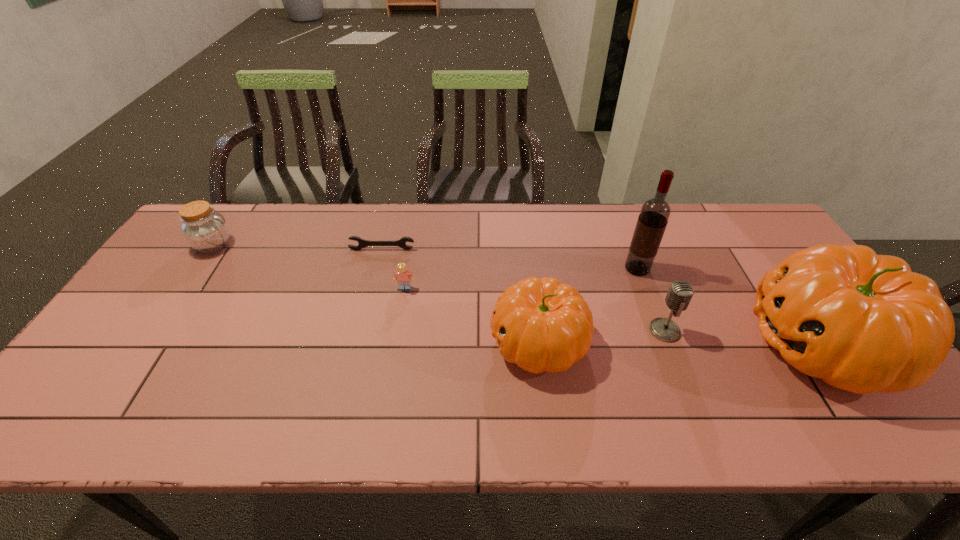
This screenshot has height=540, width=960. Find the location of `free space at the left edge`. free space at the left edge is located at coordinates (202, 262).

At what (x,y) coordinates should I click in order to perform the action: click on free location at the near left corner of the desktop. Please return your answer as a coordinate pair (x, y). The image size is (960, 540). Looking at the image, I should click on (86, 374).

You are a GUI agent. You are given a task and a screenshot of the screen. Output one action in this format:
    pyautogui.click(x=<x>, y=<y>)
    Task: Click on the vacant space at the near right corner
    This screenshot has width=960, height=540.
    Given the screenshot: What is the action you would take?
    pyautogui.click(x=881, y=397)

Locate an element on the screen. The image size is (960, 540). unoccupied position between the tallest object and the Lego is located at coordinates (521, 279).

Where is `free area in between the third farthest object and the wrench`? This screenshot has width=960, height=540. free area in between the third farthest object and the wrench is located at coordinates (510, 259).

Find the location of a particular element. Image resolution: width=960 pixels, height=540 pixels. vacant space in between the fourth object from left to right and the wine bottle is located at coordinates (588, 305).

You are a GUI agent. You are given a task and a screenshot of the screen. Output one action in this format:
    pyautogui.click(x=<x>, y=<y>)
    Task: Click on the vacant area that lies between the taller pumpkin and the shortest object
    This screenshot has height=540, width=960.
    Given the screenshot: What is the action you would take?
    (x=602, y=296)

The width and height of the screenshot is (960, 540). In order to click on vacant space in between the fourth object from right to left and the wrench in this screenshot , I will do `click(461, 296)`.

This screenshot has height=540, width=960. What are the coordinates of `vacant space in between the microphone and the fifth nearest object` in the screenshot? It's located at (651, 300).

Locate an element on the screen. The image size is (960, 540). vacant point located between the microphone and the shorter pumpkin is located at coordinates (602, 336).